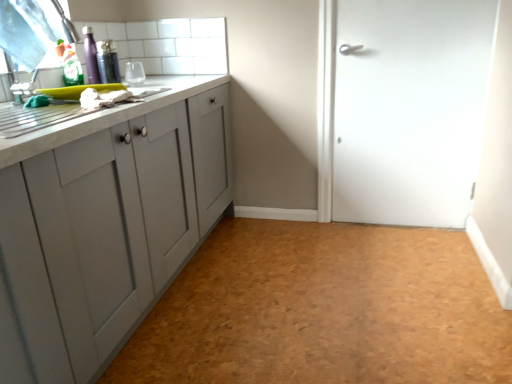
Locate an element on the screen. vacant space positioned to the left of white matte door at right is located at coordinates (329, 240).